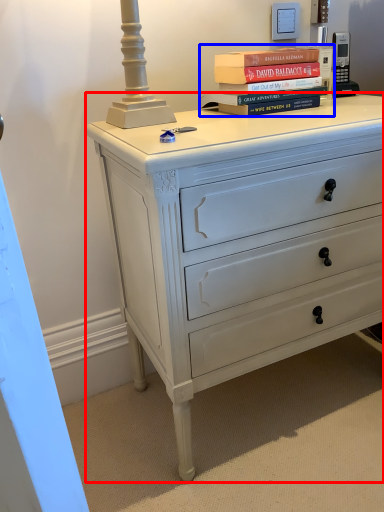
Question: Which of the following is the closest to the observer, chest of drawers (highlighted by a red box) or book (highlighted by a blue box)?

Choices:
 (A) chest of drawers
 (B) book

Answer: (A)